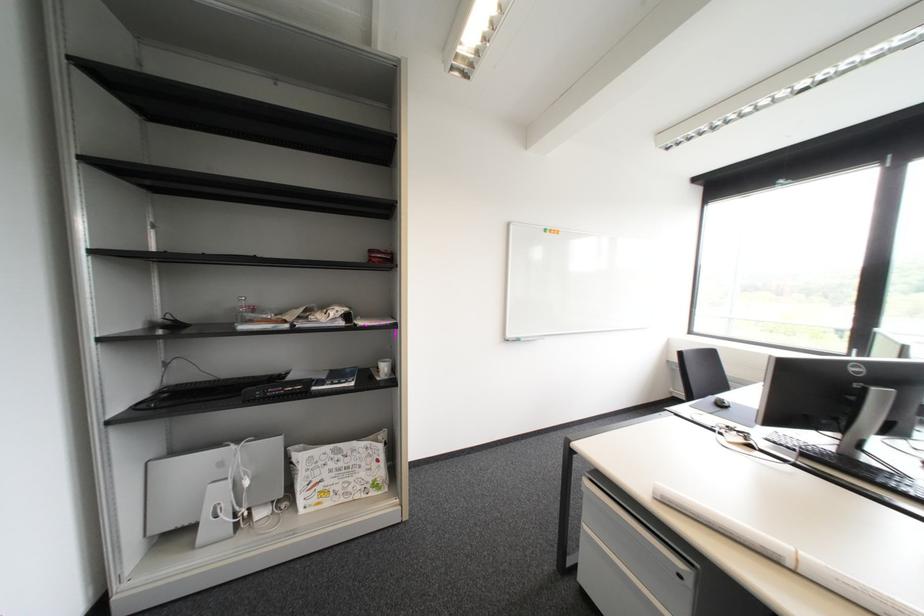
Locate an element on the screen. white mug is located at coordinates (384, 368).